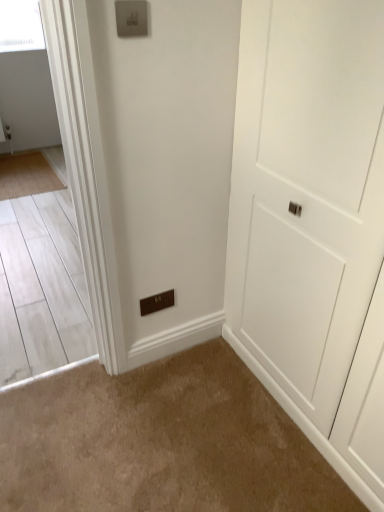
Question: From a real-world perspective, is brown matte switchplate at lower center over bamboo mat at left?

Choices:
 (A) yes
 (B) no

Answer: (A)

Question: Is bamboo mat at left at the back of brown matte switchplate at lower center?

Choices:
 (A) no
 (B) yes

Answer: (A)

Question: From the image's perspective, would you say brown matte switchplate at lower center is shown under bamboo mat at left?

Choices:
 (A) no
 (B) yes

Answer: (B)

Question: Can you confirm if brown matte switchplate at lower center is taller than bamboo mat at left?

Choices:
 (A) no
 (B) yes

Answer: (A)

Question: Is brown matte switchplate at lower center not within bamboo mat at left?

Choices:
 (A) no
 (B) yes

Answer: (B)

Question: From the image's perspective, is brown matte switchplate at lower center on bamboo mat at left?

Choices:
 (A) no
 (B) yes

Answer: (A)

Question: From a real-world perspective, is bamboo mat at left located beneath white matte door at center?

Choices:
 (A) yes
 (B) no

Answer: (A)

Question: Could you tell me if bamboo mat at left is facing white matte door at center?

Choices:
 (A) yes
 (B) no

Answer: (B)

Question: Is bamboo mat at left completely or partially outside of white matte door at center?

Choices:
 (A) yes
 (B) no

Answer: (A)

Question: Can white matte door at center be found inside bamboo mat at left?

Choices:
 (A) no
 (B) yes

Answer: (A)

Question: Is bamboo mat at left to the left of white matte door at center from the viewer's perspective?

Choices:
 (A) yes
 (B) no

Answer: (A)

Question: From a real-world perspective, does bamboo mat at left stand above white matte door at center?

Choices:
 (A) no
 (B) yes

Answer: (A)

Question: Can we say white matte door at center lies outside bamboo mat at left?

Choices:
 (A) yes
 (B) no

Answer: (A)